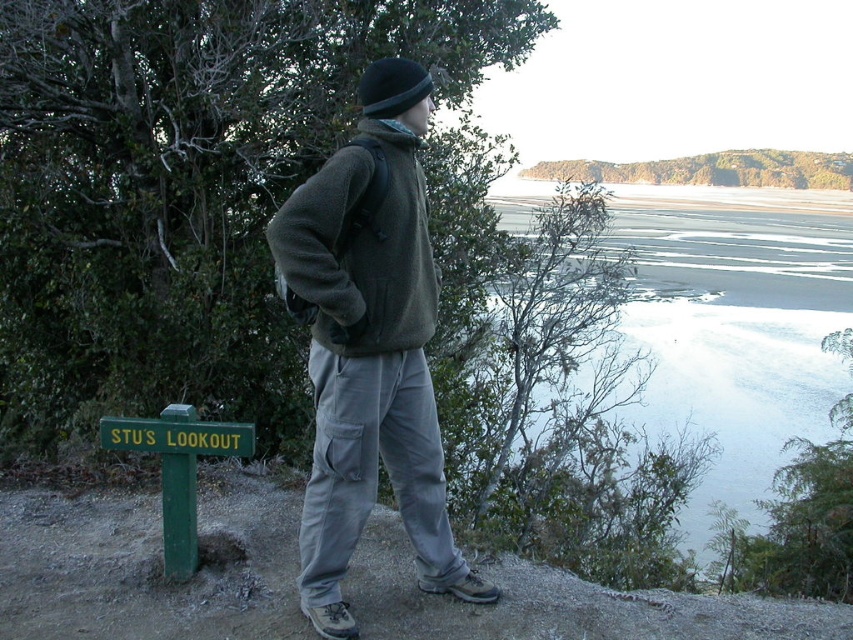
Question: Which of the following is the farthest from the observer?

Choices:
 (A) (723, 380)
 (B) (160, 436)
 (C) (380, 116)

Answer: (A)

Question: Is matte green fleece jacket at center thinner than black woolen hat at center?

Choices:
 (A) no
 (B) yes

Answer: (A)

Question: Is clear water at lower right smaller than fuzzy green jacket at center?

Choices:
 (A) yes
 (B) no

Answer: (B)

Question: Is fuzzy green jacket at center above green painted wood sign at lower left?

Choices:
 (A) yes
 (B) no

Answer: (A)

Question: Among these objects, which one is farthest from the camera?

Choices:
 (A) black woolen hat at center
 (B) green painted wood sign at lower left
 (C) clear water at lower right
 (D) fuzzy green jacket at center

Answer: (C)

Question: Which object appears farthest from the camera in this image?

Choices:
 (A) matte green fleece jacket at center
 (B) green painted wood sign at lower left
 (C) black woolen hat at center
 (D) clear water at lower right

Answer: (D)